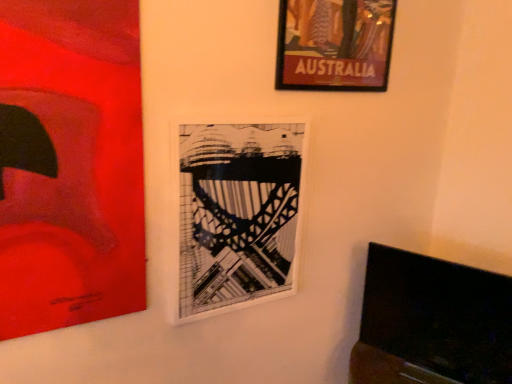
Question: Does wooden-framed poster at upper right, positioned as the 1th picture frame in right-to-left order, lie in front of matte red painting at left, which appears as the 3th picture frame when viewed from the right?

Choices:
 (A) no
 (B) yes

Answer: (A)

Question: Is wooden-framed poster at upper right, positioned as the 1th picture frame in right-to-left order, positioned with its back to matte red painting at left, which appears as the first picture frame when viewed from the left?

Choices:
 (A) yes
 (B) no

Answer: (B)

Question: Considering the relative sizes of wooden-framed poster at upper right, positioned as the 1th picture frame in right-to-left order, and matte red painting at left, which appears as the first picture frame when viewed from the left, in the image provided, is wooden-framed poster at upper right, positioned as the 1th picture frame in right-to-left order, taller than matte red painting at left, which appears as the first picture frame when viewed from the left,?

Choices:
 (A) no
 (B) yes

Answer: (A)

Question: Is wooden-framed poster at upper right, arranged as the third picture frame when viewed from the left, smaller than matte red painting at left, which appears as the first picture frame when viewed from the left?

Choices:
 (A) no
 (B) yes

Answer: (B)

Question: Can you see wooden-framed poster at upper right, arranged as the third picture frame when viewed from the left, touching matte red painting at left, which appears as the 3th picture frame when viewed from the right?

Choices:
 (A) no
 (B) yes

Answer: (A)

Question: Does wooden-framed poster at upper right, positioned as the 1th picture frame in right-to-left order, have a greater width compared to matte red painting at left, which appears as the 3th picture frame when viewed from the right?

Choices:
 (A) yes
 (B) no

Answer: (A)

Question: Can you confirm if matte red painting at left, which appears as the first picture frame when viewed from the left, is positioned to the right of wooden-framed poster at upper right, arranged as the third picture frame when viewed from the left?

Choices:
 (A) no
 (B) yes

Answer: (A)

Question: Is matte red painting at left, which appears as the 3th picture frame when viewed from the right, oriented away from wooden-framed poster at upper right, arranged as the third picture frame when viewed from the left?

Choices:
 (A) yes
 (B) no

Answer: (B)

Question: Is matte red painting at left, which appears as the 3th picture frame when viewed from the right, to the left of wooden-framed poster at upper right, arranged as the third picture frame when viewed from the left, from the viewer's perspective?

Choices:
 (A) yes
 (B) no

Answer: (A)

Question: From a real-world perspective, is matte red painting at left, which appears as the 3th picture frame when viewed from the right, physically above wooden-framed poster at upper right, arranged as the third picture frame when viewed from the left?

Choices:
 (A) no
 (B) yes

Answer: (A)

Question: Are matte red painting at left, which appears as the first picture frame when viewed from the left, and wooden-framed poster at upper right, arranged as the third picture frame when viewed from the left, far apart?

Choices:
 (A) yes
 (B) no

Answer: (B)

Question: Is matte red painting at left, which appears as the 3th picture frame when viewed from the right, taller than wooden-framed poster at upper right, positioned as the 1th picture frame in right-to-left order?

Choices:
 (A) no
 (B) yes

Answer: (B)

Question: Could you tell me if wooden-framed poster at upper right, positioned as the 1th picture frame in right-to-left order, is facing white matte picture frame at center, which is the second picture frame from right to left?

Choices:
 (A) no
 (B) yes

Answer: (A)